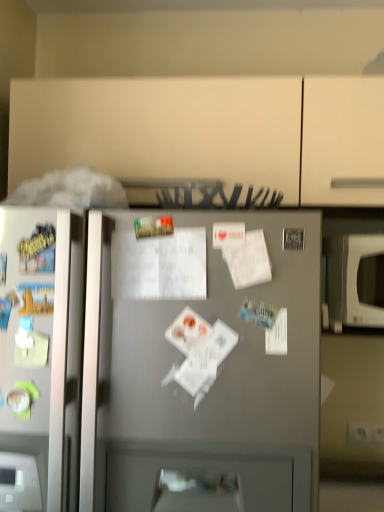
Question: Is white glossy microwave at right not close to white matte paper at center?

Choices:
 (A) no
 (B) yes

Answer: (A)

Question: Does white glossy microwave at right lie in front of white matte paper at center?

Choices:
 (A) no
 (B) yes

Answer: (A)

Question: Considering the relative sizes of white glossy microwave at right and white matte paper at center in the image provided, is white glossy microwave at right taller than white matte paper at center?

Choices:
 (A) yes
 (B) no

Answer: (A)

Question: Is white glossy microwave at right at the right side of white matte paper at center?

Choices:
 (A) yes
 (B) no

Answer: (A)

Question: From the image's perspective, does white glossy microwave at right appear lower than white matte paper at center?

Choices:
 (A) yes
 (B) no

Answer: (A)

Question: From a real-world perspective, relative to satin silver refrigerator at center, is white glossy microwave at right vertically above or below?

Choices:
 (A) above
 (B) below

Answer: (A)

Question: In terms of height, does white glossy microwave at right look taller or shorter compared to satin silver refrigerator at center?

Choices:
 (A) tall
 (B) short

Answer: (B)

Question: In the image, is white glossy microwave at right on the left side or the right side of satin silver refrigerator at center?

Choices:
 (A) right
 (B) left

Answer: (A)

Question: Is point (372, 287) positioned closer to the camera than point (137, 441)?

Choices:
 (A) closer
 (B) farther

Answer: (B)

Question: From a real-world perspective, relative to white matte paper at center, is white glossy microwave at right vertically above or below?

Choices:
 (A) below
 (B) above

Answer: (A)

Question: Considering the positions of point coord(362,324) and point coord(238,286), is point coord(362,324) closer or farther from the camera than point coord(238,286)?

Choices:
 (A) closer
 (B) farther

Answer: (B)

Question: Considering the positions of white glossy microwave at right and white matte paper at center in the image, is white glossy microwave at right taller or shorter than white matte paper at center?

Choices:
 (A) short
 (B) tall

Answer: (B)

Question: Is white glossy microwave at right bigger or smaller than white matte paper at center?

Choices:
 (A) big
 (B) small

Answer: (A)

Question: From a real-world perspective, is satin silver refrigerator at center physically located above or below white glossy microwave at right?

Choices:
 (A) above
 (B) below

Answer: (B)

Question: Is satin silver refrigerator at center taller or shorter than white glossy microwave at right?

Choices:
 (A) short
 (B) tall

Answer: (B)